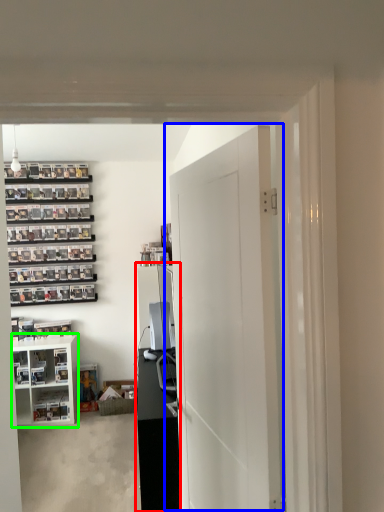
Question: Which object is positioned farthest from entertainment center (highlighted by a red box)? Select from door (highlighted by a blue box) and cabinetry (highlighted by a green box).

Choices:
 (A) door
 (B) cabinetry

Answer: (B)